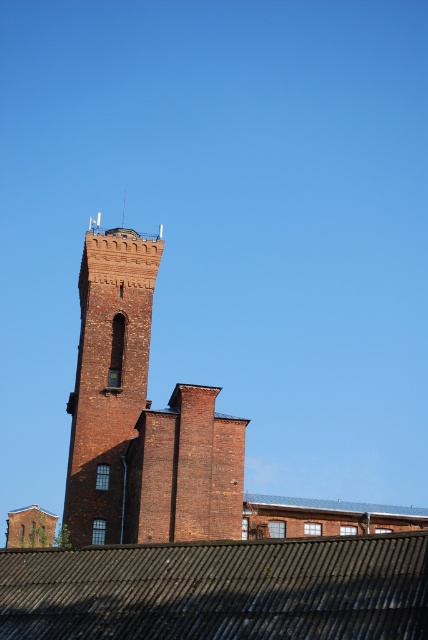
Question: Does brick tower at upper left appear on the right side of metallic corrugated roof at center?

Choices:
 (A) no
 (B) yes

Answer: (A)

Question: Is rusty corrugated metal roof at lower center wider than metallic corrugated roof at center?

Choices:
 (A) no
 (B) yes

Answer: (A)

Question: Which is nearer to the rusty corrugated metal roof at lower center?

Choices:
 (A) metallic corrugated roof at center
 (B) brick tower at upper left

Answer: (A)

Question: Which object is farther from the camera taking this photo?

Choices:
 (A) brick tower at upper left
 (B) rusty corrugated metal roof at lower center

Answer: (A)

Question: Which object is the farthest from the brick tower at upper left?

Choices:
 (A) metallic corrugated roof at center
 (B) rusty corrugated metal roof at lower center

Answer: (A)

Question: Is rusty corrugated metal roof at lower center positioned in front of metallic corrugated roof at center?

Choices:
 (A) no
 (B) yes

Answer: (B)